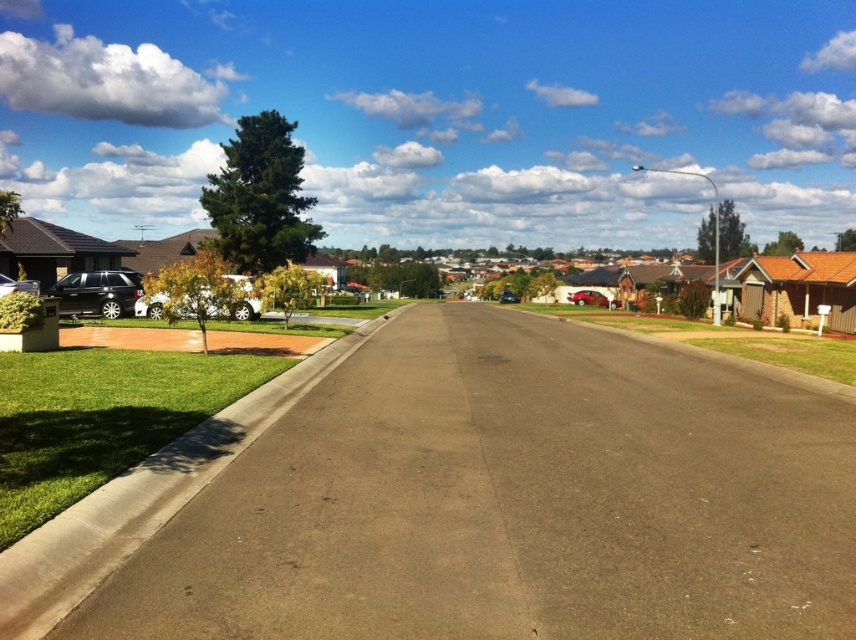
Does shiny black car at left have a greater height compared to metallic blue sedan at center?

Incorrect, shiny black car at left's height is not larger of metallic blue sedan at center's.

Is shiny black car at left bigger than metallic blue sedan at center?

No.

Is point (123, 288) positioned behind point (515, 292)?

No, (123, 288) is in front of (515, 292).

Where is `shiny black car at left`? This screenshot has height=640, width=856. shiny black car at left is located at coordinates (97, 292).

Which is below, shiny red sedan at center-right or metallic blue sedan at center?

shiny red sedan at center-right is below.

Is shiny red sedan at center-right to the right of metallic blue sedan at center from the viewer's perspective?

Indeed, shiny red sedan at center-right is positioned on the right side of metallic blue sedan at center.

What do you see at coordinates (587, 298) in the screenshot? The width and height of the screenshot is (856, 640). I see `shiny red sedan at center-right` at bounding box center [587, 298].

Identify the location of shiny red sedan at center-right. The width and height of the screenshot is (856, 640). (587, 298).

Is shiny silver sedan at left in front of metallic blue sedan at center?

Yes, shiny silver sedan at left is in front of metallic blue sedan at center.

Which is in front, point (7, 289) or point (508, 296)?

Point (7, 289)

Image resolution: width=856 pixels, height=640 pixels. I want to click on shiny silver sedan at left, so click(16, 285).